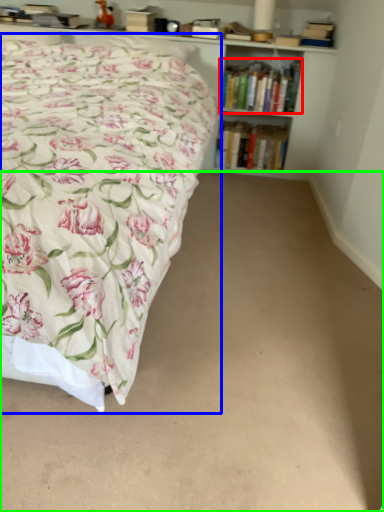
Question: Which object is positioned closest to book (highlighted by a red box)? Select from bed (highlighted by a blue box) and plain (highlighted by a green box).

Choices:
 (A) bed
 (B) plain

Answer: (A)